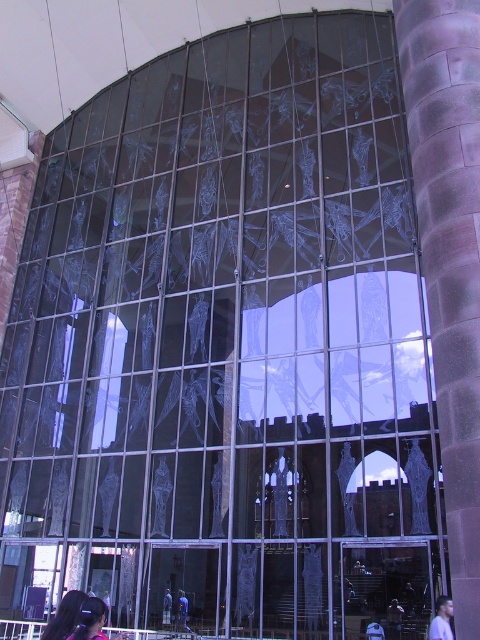
Question: Considering the relative positions of smooth black hair at lower left and dark blue fabric at lower center in the image provided, where is smooth black hair at lower left located with respect to dark blue fabric at lower center?

Choices:
 (A) left
 (B) right

Answer: (A)

Question: Which object is closer to the camera taking this photo?

Choices:
 (A) blue denim jeans at center
 (B) light blue shirt at lower right
 (C) purple stone pillar at right
 (D) blue fabric shirt at lower center

Answer: (C)

Question: Does light blue shirt at lower right appear under blue fabric shirt at lower center?

Choices:
 (A) yes
 (B) no

Answer: (B)

Question: Which point is closer to the camera?

Choices:
 (A) (431, 621)
 (B) (164, 611)
 (C) (183, 600)
 (D) (425, 250)

Answer: (D)

Question: Which is farther from the light blue shirt at lower right?

Choices:
 (A) purple stone pillar at right
 (B) dark blue fabric at lower center
 (C) blue fabric shirt at lower center
 (D) blue denim jeans at center

Answer: (C)

Question: Does blue denim jeans at center appear under dark blue fabric at lower center?

Choices:
 (A) no
 (B) yes

Answer: (B)